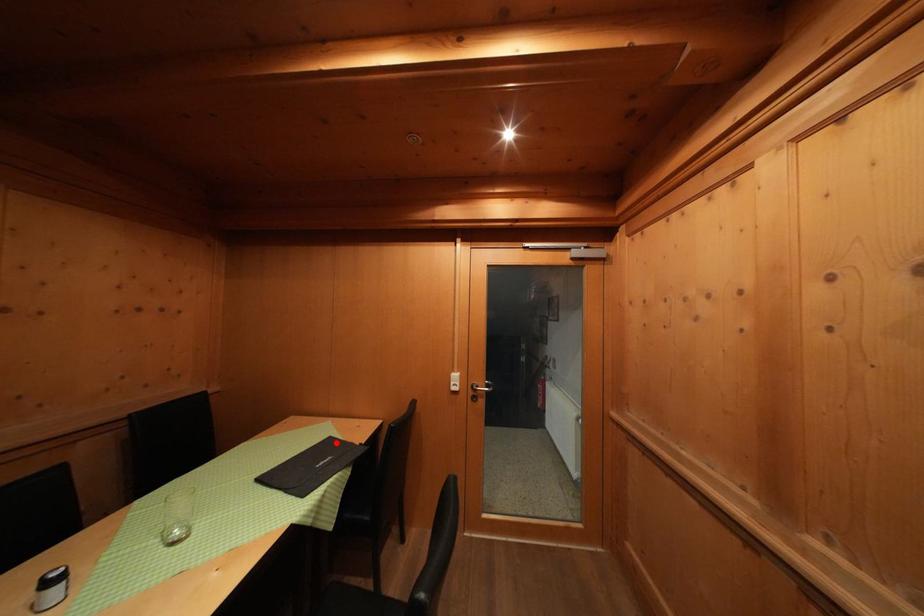
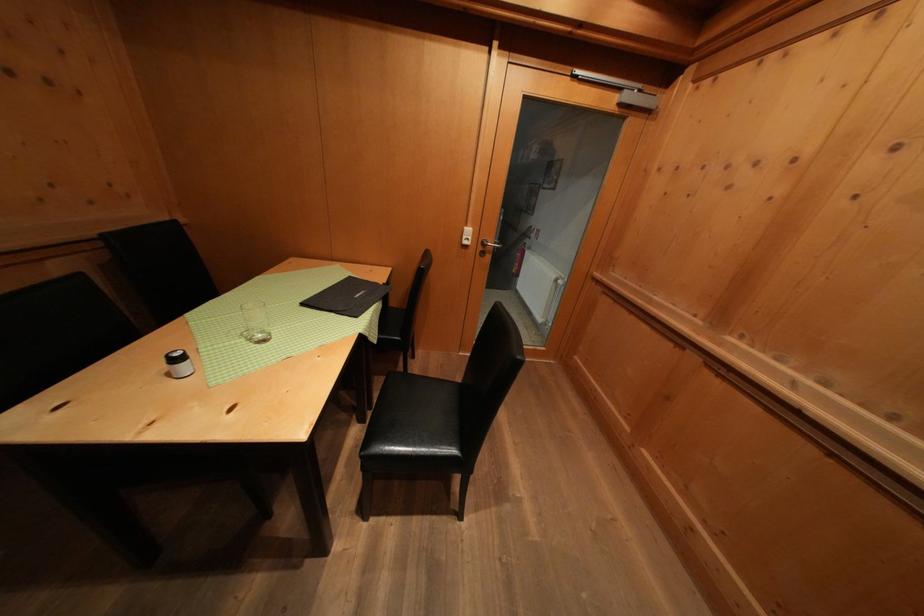
The point at the highlighted location is marked in the first image. Where is the corresponding point in the second image?

(357, 283)